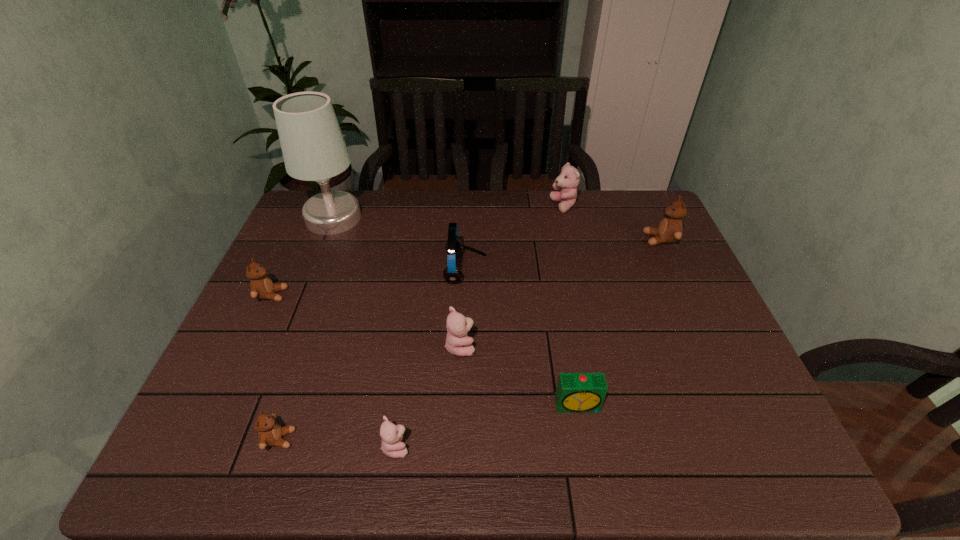
Locate an element on the screen. The image size is (960, 540). the second biggest pink teddy bear is located at coordinates (458, 343).

At what (x,y) coordinates should I click in order to perform the action: click on green alarm clock. Please return your answer as a coordinate pair (x, y). Image resolution: width=960 pixels, height=540 pixels. Looking at the image, I should click on (576, 392).

At what (x,y) coordinates should I click in order to perform the action: click on alarm clock. Please return your answer as a coordinate pair (x, y). Image resolution: width=960 pixels, height=540 pixels. Looking at the image, I should click on (576, 392).

The width and height of the screenshot is (960, 540). Find the location of `the nearest brown teddy bear`. the nearest brown teddy bear is located at coordinates point(270,432).

Image resolution: width=960 pixels, height=540 pixels. Identify the location of the second brown teddy bear from left to right. (270, 432).

You are a GUI agent. You are given a task and a screenshot of the screen. Output one action in this format:
    pyautogui.click(x=<x>, y=<y>)
    Task: Click on the nearest pink teddy bear
    The height and width of the screenshot is (540, 960).
    Given the screenshot: What is the action you would take?
    pyautogui.click(x=391, y=434)

I want to click on the leftmost pink teddy bear, so [x=391, y=434].

The image size is (960, 540). I want to click on vacant space located on the base of the tallest object, so pyautogui.click(x=398, y=218).

At what (x,y) coordinates should I click in order to perform the action: click on vacant space located 0.240m at the face of the biggest pink teddy bear. Please return your answer as a coordinate pair (x, y). The height and width of the screenshot is (540, 960). Looking at the image, I should click on [x=480, y=206].

Locate an element on the screen. The width and height of the screenshot is (960, 540). free spot located at the face of the biggest pink teddy bear is located at coordinates (440, 206).